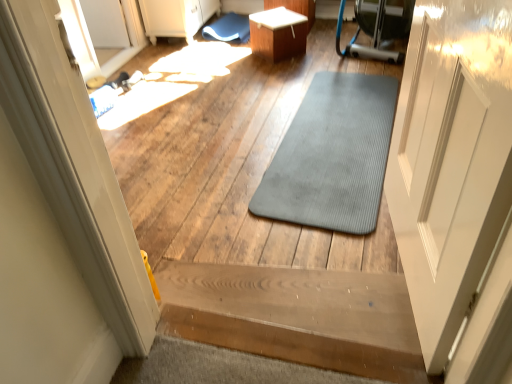
The height and width of the screenshot is (384, 512). Identify the location of vacant space underneath gray rubber mat at center (from a real-world perspective). (344, 114).